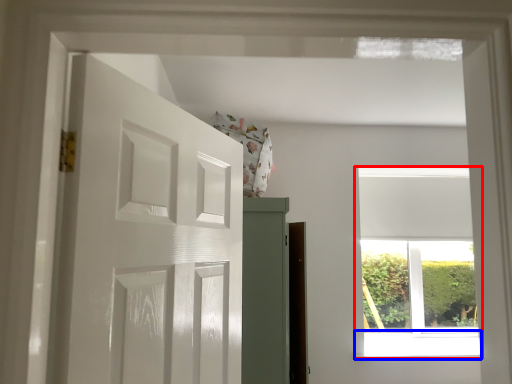
Question: Which object is closer to the camera taking this photo, window (highlighted by a red box) or window sill (highlighted by a blue box)?

Choices:
 (A) window
 (B) window sill

Answer: (B)